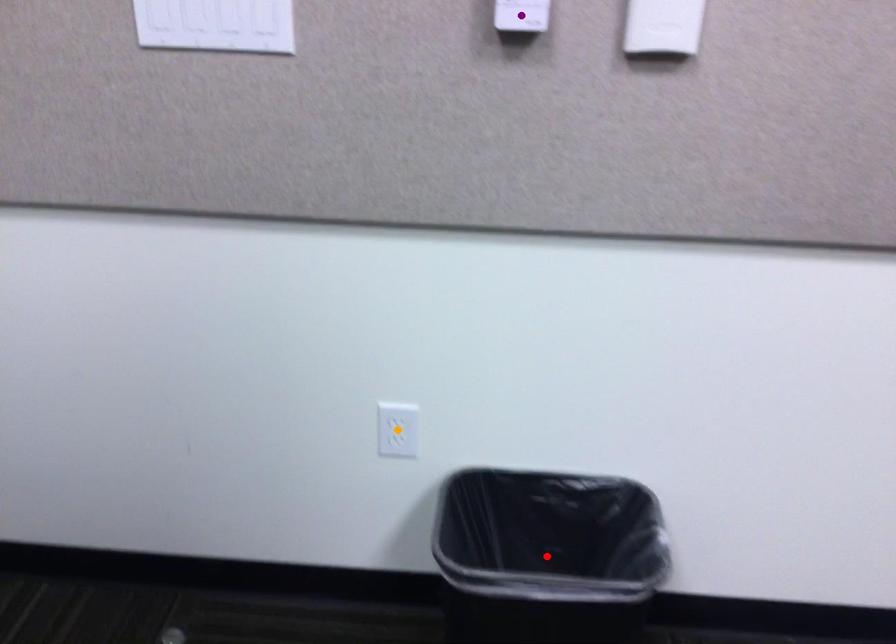
Order these from nearest to farthest:
orange point
purple point
red point

1. purple point
2. orange point
3. red point